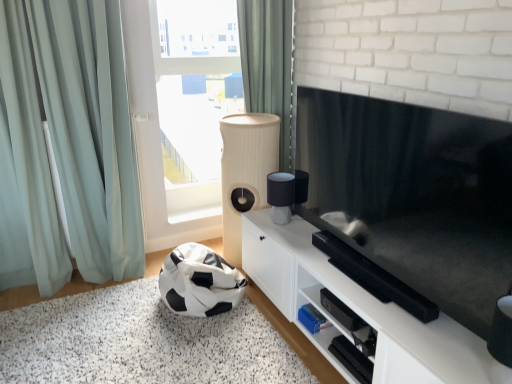
Question: Is black and white fabric bean bag at lower left positioned before green fabric curtain at upper center, arranged as the second curtain when viewed from the left?

Choices:
 (A) no
 (B) yes

Answer: (B)

Question: Is black and white fabric bean bag at lower left positioned behind green fabric curtain at upper center, arranged as the second curtain when viewed from the left?

Choices:
 (A) yes
 (B) no

Answer: (B)

Question: Does black and white fabric bean bag at lower left turn towards green fabric curtain at upper center, arranged as the second curtain when viewed from the left?

Choices:
 (A) yes
 (B) no

Answer: (B)

Question: Does black and white fabric bean bag at lower left have a larger size compared to green fabric curtain at upper center, arranged as the second curtain when viewed from the left?

Choices:
 (A) yes
 (B) no

Answer: (A)

Question: Is black and white fabric bean bag at lower left at the left side of green fabric curtain at upper center, arranged as the second curtain when viewed from the left?

Choices:
 (A) yes
 (B) no

Answer: (A)

Question: Is beige ribbed speaker at center bigger or smaller than black glossy tv at center?

Choices:
 (A) big
 (B) small

Answer: (A)

Question: Is beige ribbed speaker at center wider or thinner than black glossy tv at center?

Choices:
 (A) wide
 (B) thin

Answer: (A)

Question: From the image's perspective, is beige ribbed speaker at center located above or below black glossy tv at center?

Choices:
 (A) below
 (B) above

Answer: (B)

Question: Is point (244, 120) positioned closer to the camera than point (365, 223)?

Choices:
 (A) closer
 (B) farther

Answer: (B)

Question: From the image's perspective, is black glossy tv at center located above or below light blue fabric curtain at left, positioned as the 1th curtain in left-to-right order?

Choices:
 (A) above
 (B) below

Answer: (B)

Question: From their relative heights in the image, would you say black glossy tv at center is taller or shorter than light blue fabric curtain at left, acting as the second curtain starting from the right?

Choices:
 (A) short
 (B) tall

Answer: (A)

Question: Looking at their shapes, would you say black glossy tv at center is wider or thinner than light blue fabric curtain at left, positioned as the 1th curtain in left-to-right order?

Choices:
 (A) thin
 (B) wide

Answer: (A)

Question: Considering the positions of point (464, 125) and point (113, 226), is point (464, 125) closer or farther from the camera than point (113, 226)?

Choices:
 (A) closer
 (B) farther

Answer: (A)

Question: Would you say beige ribbed speaker at center is to the left or to the right of black and white fabric bean bag at lower left in the picture?

Choices:
 (A) left
 (B) right

Answer: (B)

Question: Considering the positions of beige ribbed speaker at center and black and white fabric bean bag at lower left in the image, is beige ribbed speaker at center wider or thinner than black and white fabric bean bag at lower left?

Choices:
 (A) wide
 (B) thin

Answer: (B)